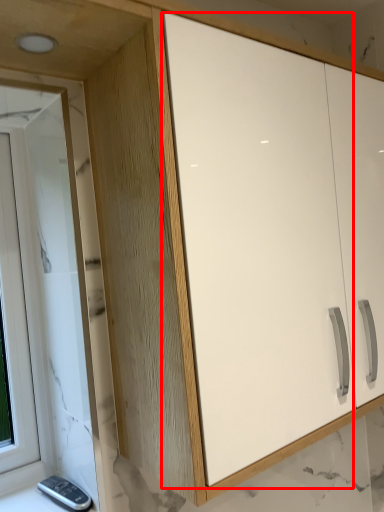
Question: From the image's perspective, what is the correct spatial positioning of screen door (annotated by the red box) in reference to window?

Choices:
 (A) below
 (B) above

Answer: (B)